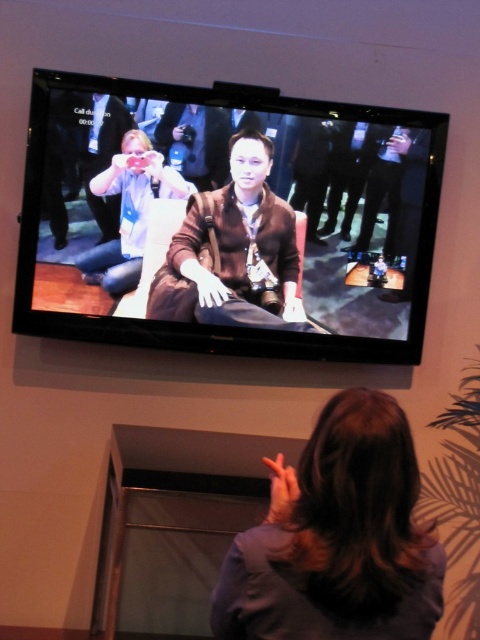
Question: From the image, what is the correct spatial relationship of matte black tv at upper center in relation to brown hair at upper center?

Choices:
 (A) right
 (B) left

Answer: (B)

Question: Does matte black tv at upper center have a smaller size compared to brown hair at upper center?

Choices:
 (A) yes
 (B) no

Answer: (B)

Question: Can you confirm if matte black tv at upper center is positioned to the left of matte black jacket at center?

Choices:
 (A) no
 (B) yes

Answer: (A)

Question: Which object is closer to the camera taking this photo?

Choices:
 (A) brown leather jacket at center
 (B) matte black tv at upper center

Answer: (B)

Question: Estimate the real-world distances between objects in this image. Which object is closer to the matte black tv at upper center?

Choices:
 (A) brown hair at upper center
 (B) matte black jacket at center

Answer: (B)

Question: Which object is closer to the camera taking this photo?

Choices:
 (A) matte black tv at upper center
 (B) brown hair at upper center
 (C) matte black jacket at center
 (D) brown leather jacket at center

Answer: (B)